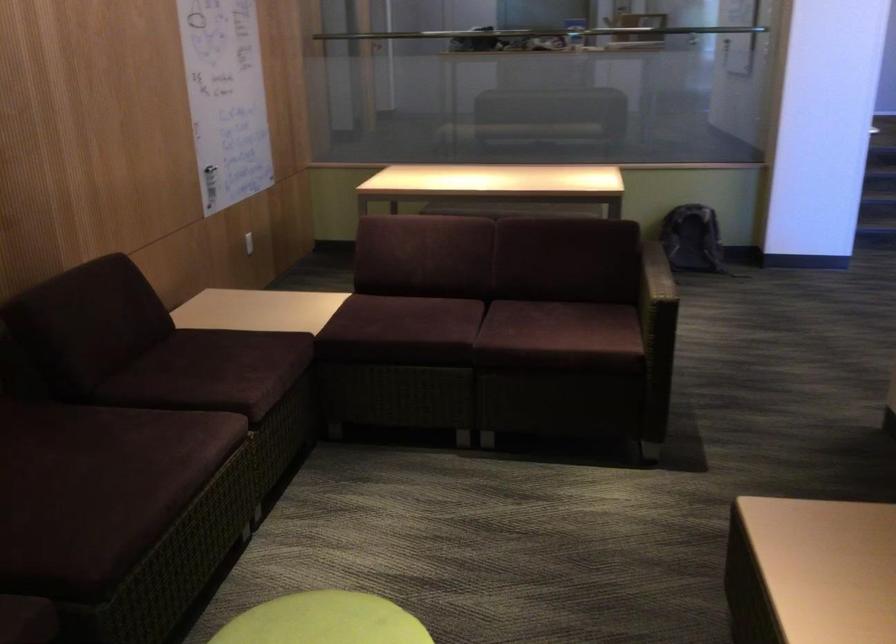
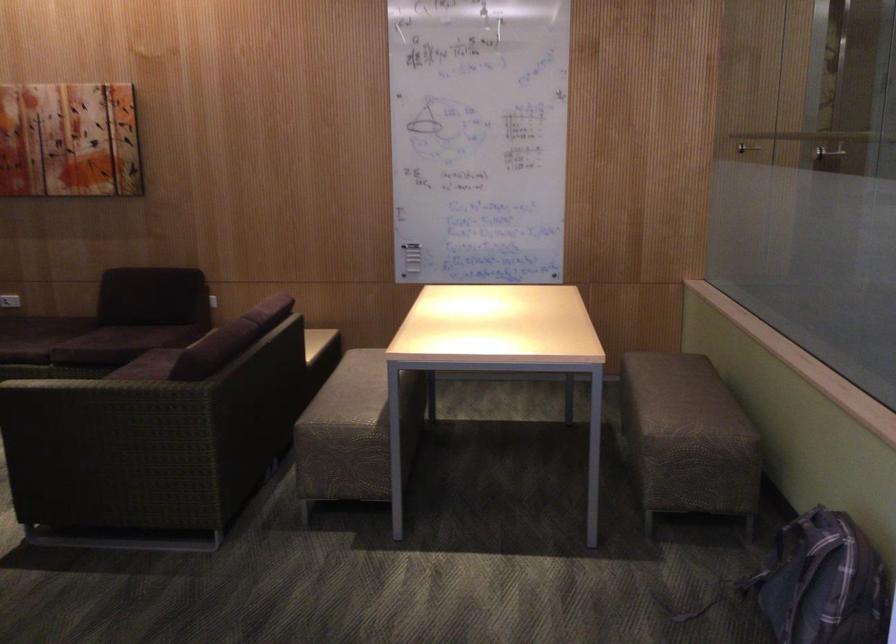
Find the pixel in the second image that matches the point at 736,241 in the first image.

(823, 583)